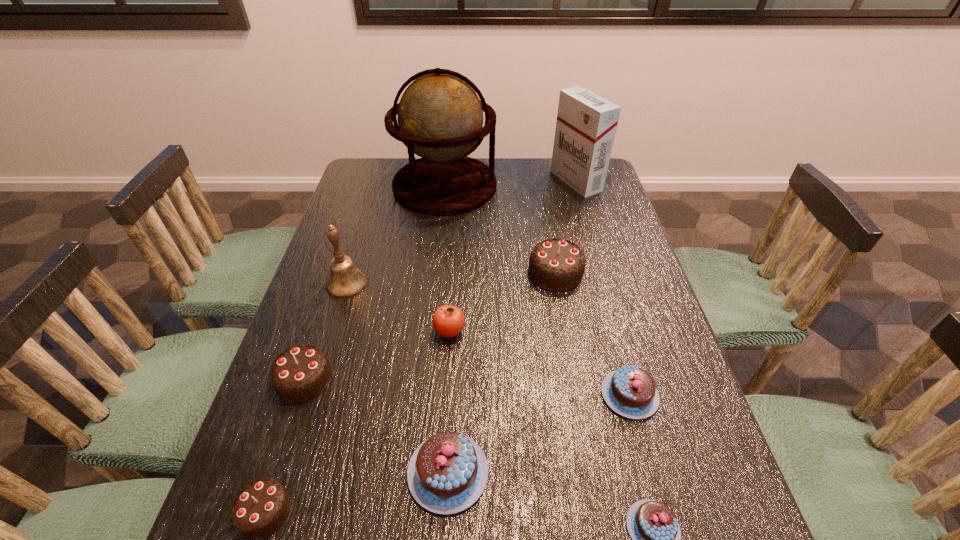
Where is `the smallest chocolate chocolate cake`? the smallest chocolate chocolate cake is located at coordinates (260, 508).

Identify the location of vacant space located 0.160m on the front-facing side of the globe. (543, 185).

Locate an element on the screen. The width and height of the screenshot is (960, 540). vacant area located on the front of the second tallest object is located at coordinates (595, 248).

At what (x,y) coordinates should I click in order to perform the action: click on free space located 0.160m on the right of the bell. Please return your answer as a coordinate pair (x, y). The image size is (960, 540). Looking at the image, I should click on (427, 284).

In order to click on vacant space located on the front of the farthest chocolate cake in this screenshot , I will do `click(564, 321)`.

Locate an element on the screen. Image resolution: width=960 pixels, height=540 pixels. blank space located on the right of the apple is located at coordinates (632, 332).

Locate an element on the screen. The image size is (960, 540). vacant space located 0.170m on the front of the second smallest chocolate chocolate cake is located at coordinates (268, 487).

The image size is (960, 540). In order to click on vacant space located on the right of the biggest pink chocolate cake in this screenshot , I will do click(574, 472).

Identify the location of vacant space situated 0.220m on the back of the second biggest pink chocolate cake. pyautogui.click(x=603, y=299).

Locate an element on the screen. This screenshot has width=960, height=540. vacant space located 0.130m on the right of the smallest chocolate chocolate cake is located at coordinates (365, 511).